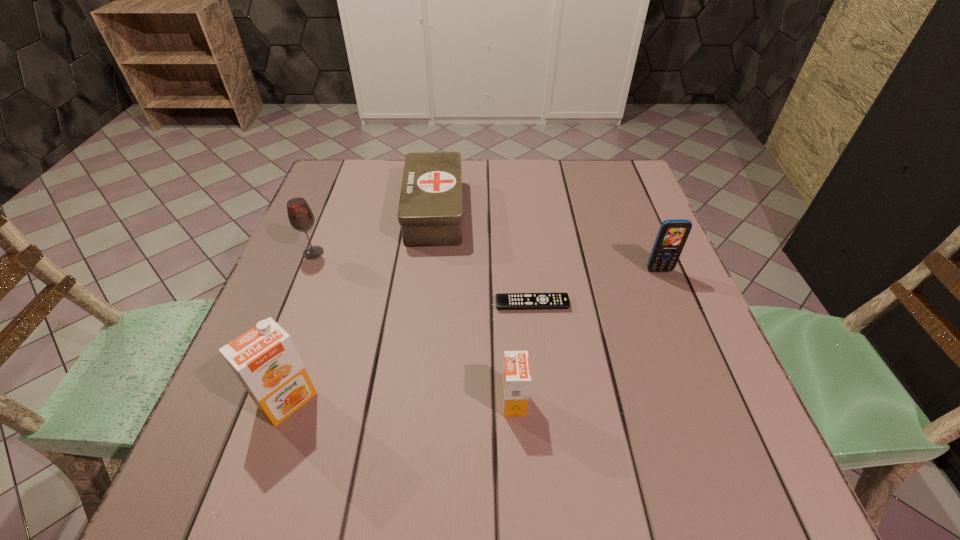
The width and height of the screenshot is (960, 540). Find the location of `object present at the right edge`. object present at the right edge is located at coordinates click(x=672, y=235).

This screenshot has height=540, width=960. What are the coordinates of `object present at the near left corner` in the screenshot? It's located at (265, 360).

You are a GUI agent. You are given a task and a screenshot of the screen. Output one action in this format:
    pyautogui.click(x=<x>, y=<y>)
    Task: Click on the vacant space at the far edge of the desktop
    This screenshot has height=540, width=960.
    Given the screenshot: What is the action you would take?
    pyautogui.click(x=564, y=192)

Identify the location of vacant space at the near edge of the desktop. (404, 397).

The height and width of the screenshot is (540, 960). I want to click on vacant space at the right edge of the desktop, so click(632, 341).

Identify the location of free space at the far left corner of the desktop. (374, 165).

Image resolution: width=960 pixels, height=540 pixels. In the image, there is a desktop. In order to click on vacant space at the near left corner in this screenshot , I will do `click(254, 431)`.

Find the location of a particular element. This screenshot has width=960, height=540. vacant space at the far right corner is located at coordinates (610, 204).

Where is `vacant space in between the rightmost object and the shorter orange juice`? vacant space in between the rightmost object and the shorter orange juice is located at coordinates (587, 336).

I want to click on vacant area between the fifth tallest object and the tallest object, so click(361, 306).